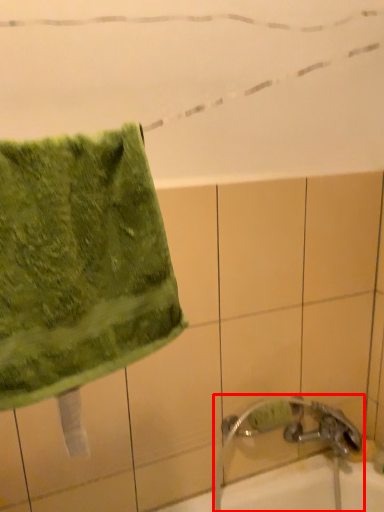
Question: From the image's perspective, considering the relative positions of faucet (annotated by the red box) and towel in the image provided, where is faucet (annotated by the red box) located with respect to the staircase?

Choices:
 (A) below
 (B) above

Answer: (A)